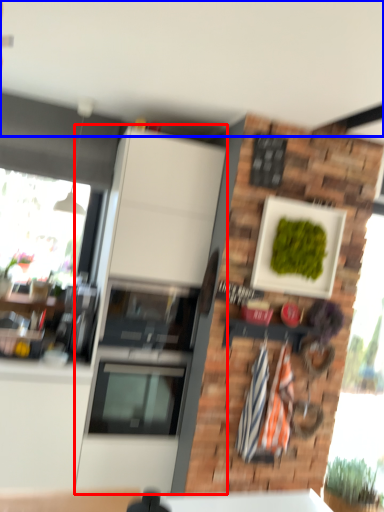
Question: Which of the following is the closest to the observer, cabinetry (highlighted by a red box) or backdrop (highlighted by a blue box)?

Choices:
 (A) cabinetry
 (B) backdrop

Answer: (B)